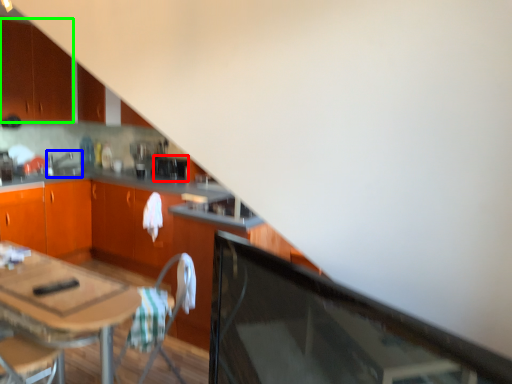
Question: Which object is the farthest from appliance (highlighted by a red box)? Choose among these: sink (highlighted by a blue box) or cabinetry (highlighted by a green box).

Choices:
 (A) sink
 (B) cabinetry

Answer: (B)